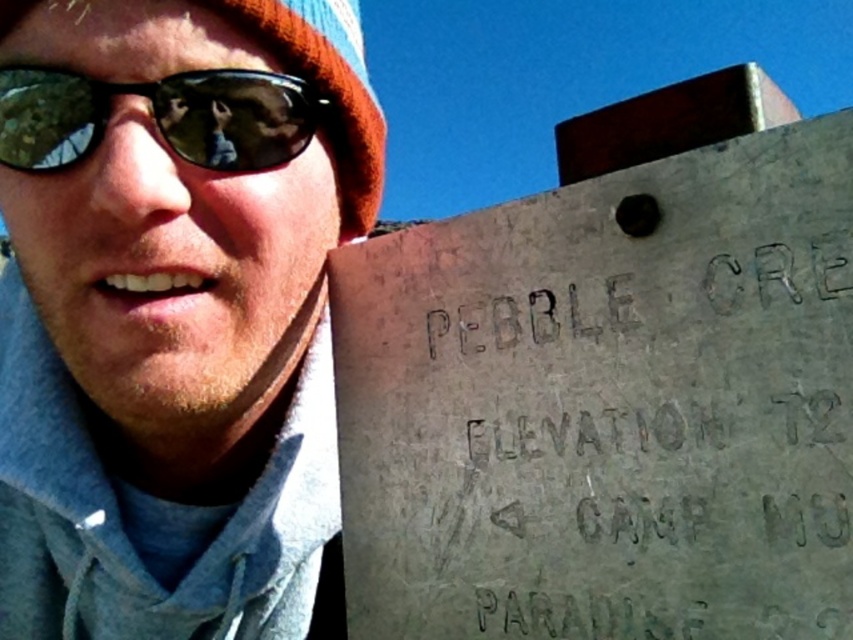
Is matte gray concrete sign at upper right wider than green reflective lens at left?

Correct, the width of matte gray concrete sign at upper right exceeds that of green reflective lens at left.

Does matte gray concrete sign at upper right have a greater height compared to green reflective lens at left?

Yes, matte gray concrete sign at upper right is taller than green reflective lens at left.

Does point (149, 84) lie behind point (247, 150)?

That is False.

Identify the location of matte gray concrete sign at upper right. (173, 308).

Between gray concrete sign at right and matte gray concrete sign at upper right, which one is positioned lower?

gray concrete sign at right is below.

Locate an element on the screen. The height and width of the screenshot is (640, 853). gray concrete sign at right is located at coordinates (608, 404).

Locate an element on the screen. The height and width of the screenshot is (640, 853). gray concrete sign at right is located at coordinates (608, 404).

Does gray concrete sign at right have a greater width compared to green reflective lens at left?

Indeed, gray concrete sign at right has a greater width compared to green reflective lens at left.

Does point (827, 362) come farther from viewer compared to point (32, 156)?

No.

Where is `gray concrete sign at right`? Image resolution: width=853 pixels, height=640 pixels. gray concrete sign at right is located at coordinates (608, 404).